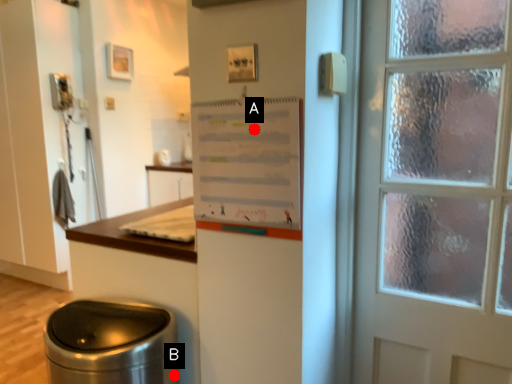
Question: Two points are circled on the image, labeled by A and B beside each circle. Which point appears farthest from the camera in this image?

Choices:
 (A) A is further
 (B) B is further

Answer: (B)